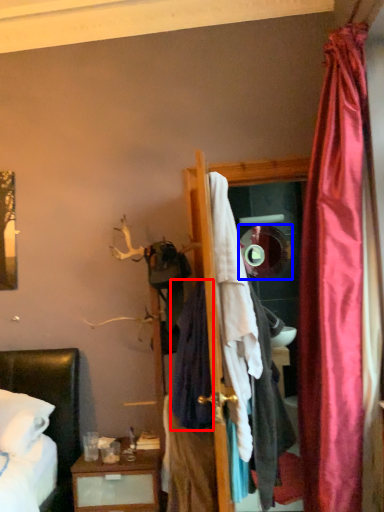
Question: Among these objects, which one is nearest to the camera, clothing (highlighted by a red box) or mirror (highlighted by a blue box)?

Choices:
 (A) clothing
 (B) mirror

Answer: (A)